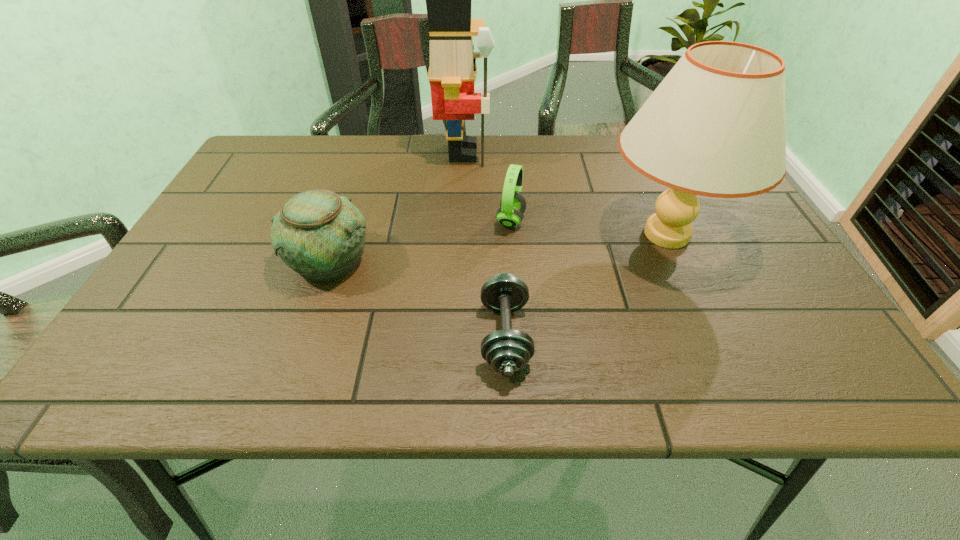
The width and height of the screenshot is (960, 540). In order to click on object at the far edge in this screenshot , I will do `click(452, 71)`.

Locate an element on the screen. object located in the near edge section of the desktop is located at coordinates (507, 351).

Identify the location of object located at the right edge. (715, 126).

This screenshot has width=960, height=540. In the image, there is a desktop. What are the coordinates of `vacant space at the far edge` in the screenshot? It's located at (589, 134).

Where is `free region at the left edge of the desktop`? The image size is (960, 540). free region at the left edge of the desktop is located at coordinates (201, 250).

This screenshot has height=540, width=960. I want to click on free space at the right edge, so click(x=806, y=320).

The image size is (960, 540). Identify the location of vacant space at the far left corner of the desktop. (267, 173).

This screenshot has height=540, width=960. I want to click on vacant space at the near right corner, so click(754, 352).

This screenshot has width=960, height=540. I want to click on free point between the farthest object and the headset, so click(487, 186).

This screenshot has height=540, width=960. I want to click on vacant area between the lampshade and the headset, so click(x=588, y=227).